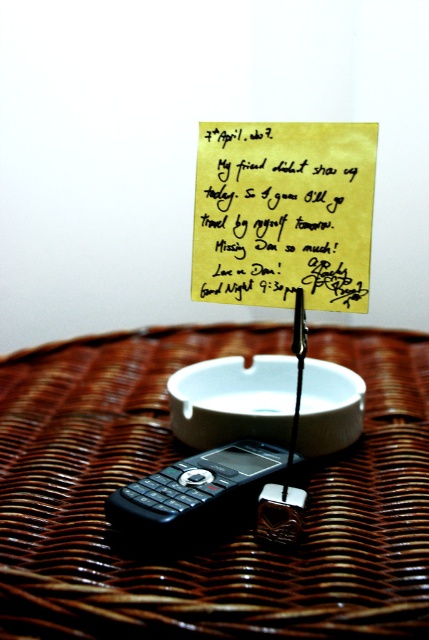
Question: Is woven brown table at center to the left of black plastic phone at center from the viewer's perspective?

Choices:
 (A) no
 (B) yes

Answer: (A)

Question: Which point is closer to the camera taking this photo?

Choices:
 (A) tap(69, 593)
 (B) tap(256, 452)
 (C) tap(362, 148)

Answer: (A)

Question: Estimate the real-world distances between objects in this image. Which object is closer to the woven brown table at center?

Choices:
 (A) black plastic phone at center
 (B) yellow paper at center

Answer: (A)

Question: Can you confirm if woven brown table at center is thinner than black plastic phone at center?

Choices:
 (A) yes
 (B) no

Answer: (B)

Question: Can you confirm if woven brown table at center is wider than black plastic phone at center?

Choices:
 (A) no
 (B) yes

Answer: (B)

Question: Which of these objects is positioned closest to the woven brown table at center?

Choices:
 (A) black plastic phone at center
 (B) yellow paper at center

Answer: (A)